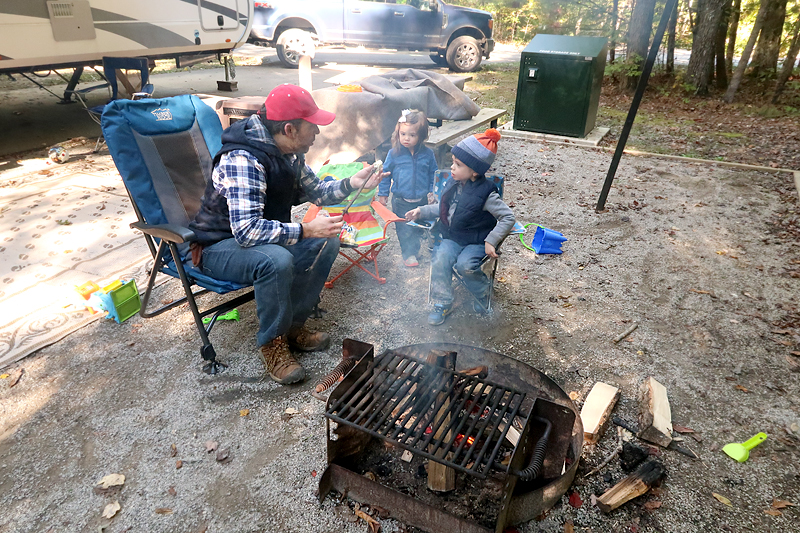
Locate an element on the screen. Image resolution: width=800 pixels, height=533 pixels. folding chair is located at coordinates (178, 164), (373, 215).